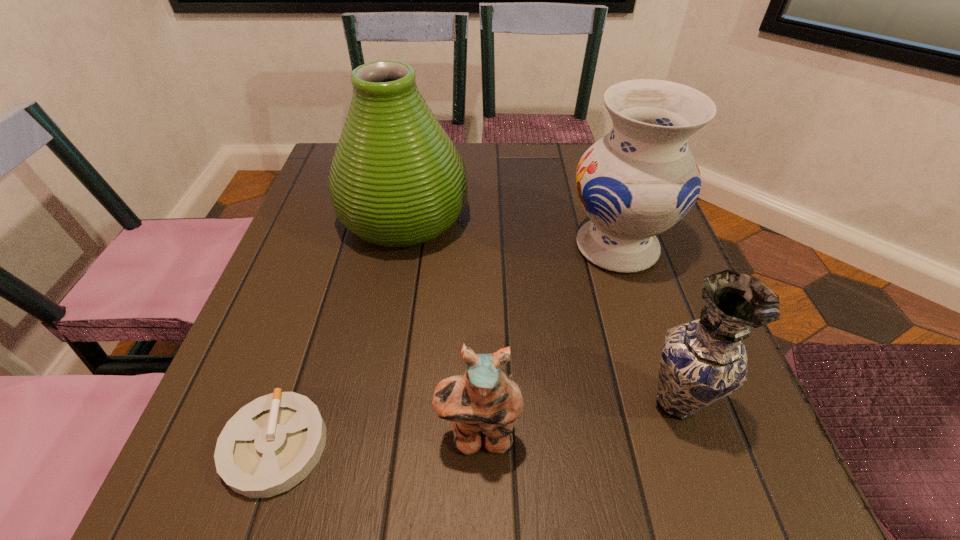
Image resolution: width=960 pixels, height=540 pixels. Identify the location of vase present at the left edge. (397, 180).

Where is `ashtray present at the left edge`? Image resolution: width=960 pixels, height=540 pixels. ashtray present at the left edge is located at coordinates (271, 444).

Locate an element on the screen. This screenshot has height=540, width=960. object that is positioned at the far left corner is located at coordinates (397, 180).

This screenshot has height=540, width=960. What are the coordinates of `object positioned at the near left corner` in the screenshot? It's located at (271, 444).

This screenshot has width=960, height=540. Identify the location of free space at the far edge of the desktop. (498, 178).

The height and width of the screenshot is (540, 960). Find the location of `free location at the near edge`. free location at the near edge is located at coordinates (423, 453).

Locate an element on the screen. The width and height of the screenshot is (960, 540). vacant space at the left edge is located at coordinates (355, 262).

Locate an element on the screen. This screenshot has width=960, height=540. blank space at the right edge of the desktop is located at coordinates (703, 443).

This screenshot has width=960, height=540. Find the location of `free space at the near left corner`. free space at the near left corner is located at coordinates (248, 498).

Locate an element on the screen. vacant space at the near right corner is located at coordinates (674, 466).